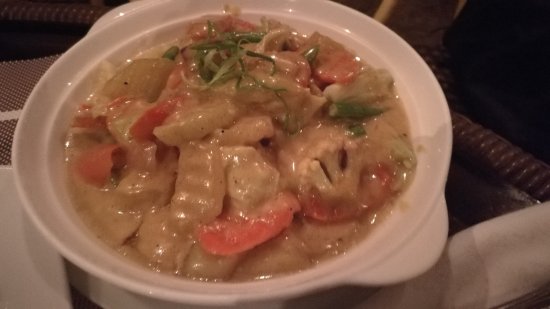
I want to click on white bowl, so click(x=338, y=26).